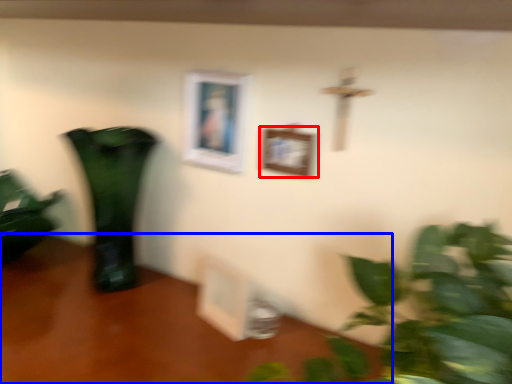
Question: Which object appears closest to the camera in this image, picture frame (highlighted by a red box) or table (highlighted by a blue box)?

Choices:
 (A) picture frame
 (B) table

Answer: (B)